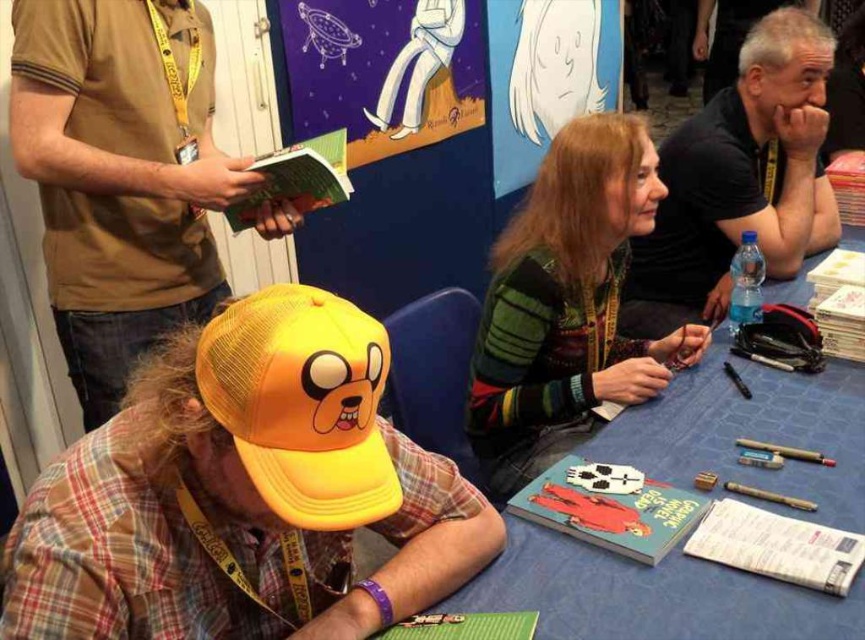
You are a photographer at the event and need to capture a photo that includes both the yellow mesh cap at center and the black mesh cap at upper right. Your camera has a maximum focus range of 5 feet. Can you position yourself so that both are within the focus range?

The distance between the yellow mesh cap at center and the black mesh cap at upper right is 4.97 feet, which is within the camera maximum focus range of 5 feet. Yes, you can position yourself so that both are within the focus range.

What object is located at the coordinates point [739,180] in the image?

The point [739,180] marks the location of the black mesh cap at upper right.

You are holding a small drone that can fly up to 80 centimeters away from you. You want to fly it to the point marked at coordinates point (354, 500). Will your drone be able to reach that point?

The distance of point (354, 500) from camera is 77.45 centimeters, so yes, the drone can reach that point since it is within the 80 centimeter range.